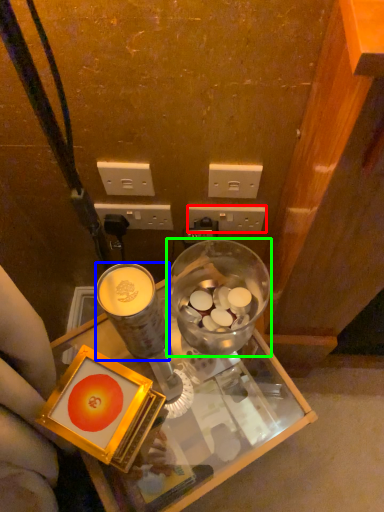
Question: Estimate the real-world distances between objects in this image. Which object is farther from power outlet (highlighted by a red box), coffee cup (highlighted by a blue box) or tableware (highlighted by a green box)?

Choices:
 (A) coffee cup
 (B) tableware

Answer: (A)